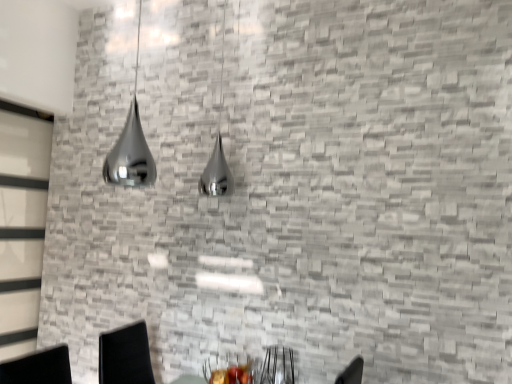
Question: Considering the relative positions of metallic black armchair at lower center and clear glass door at left in the image provided, is metallic black armchair at lower center to the left or to the right of clear glass door at left?

Choices:
 (A) right
 (B) left

Answer: (A)

Question: Is metallic black armchair at lower center wider or thinner than clear glass door at left?

Choices:
 (A) wide
 (B) thin

Answer: (A)

Question: Which of these objects is positioned farthest from the metallic black armchair at lower center?

Choices:
 (A) clear glass door at left
 (B) shiny metallic lamp at upper left

Answer: (A)

Question: Estimate the real-world distances between objects in this image. Which object is closer to the clear glass door at left?

Choices:
 (A) metallic black armchair at lower center
 (B) shiny metallic lamp at upper left

Answer: (B)